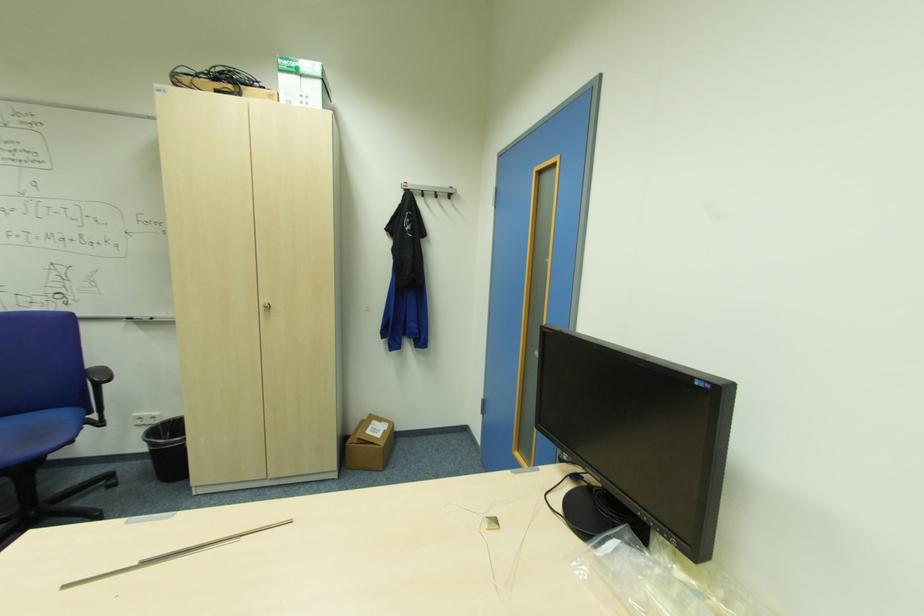
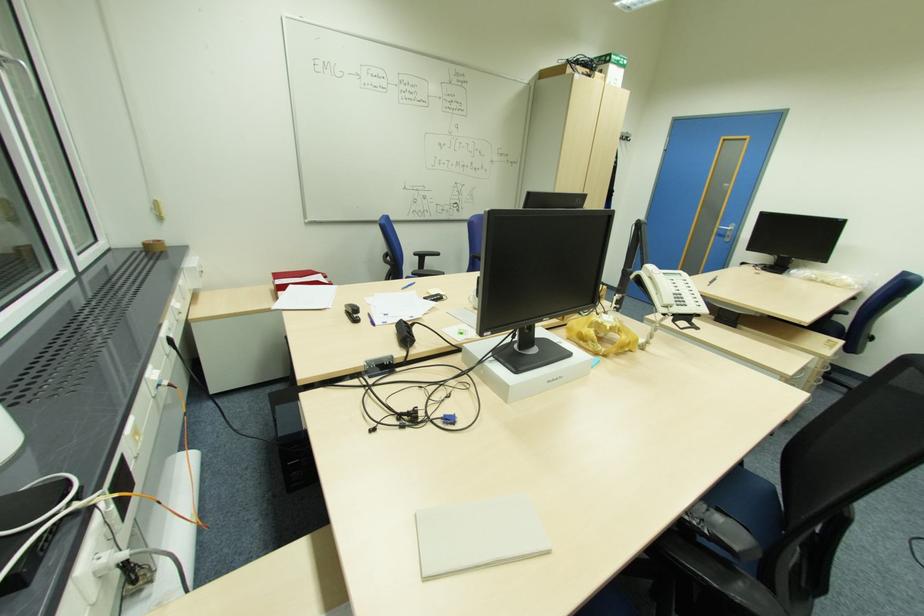
Question: The images are taken continuously from a first-person perspective. In which direction are you moving?

Choices:
 (A) Left
 (B) Right
 (C) Forward
 (D) Backward

Answer: (A)